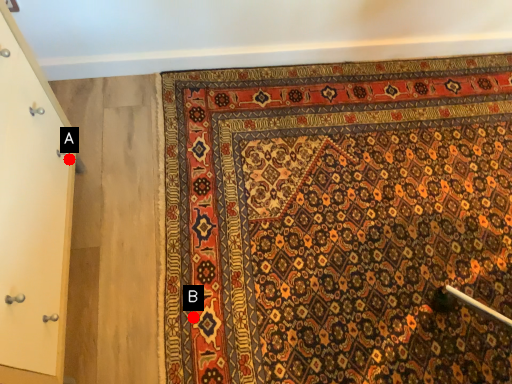
Question: Two points are circled on the image, labeled by A and B beside each circle. Which point is closer to the camera taking this photo?

Choices:
 (A) A is closer
 (B) B is closer

Answer: (B)